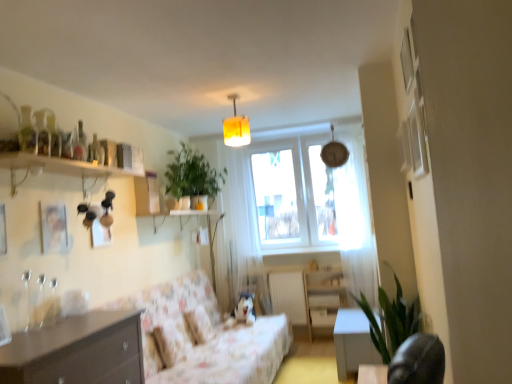
Question: Should I look upward or downward to see floral fabric couch at center?

Choices:
 (A) up
 (B) down

Answer: (B)

Question: Can you confirm if green matte plant at upper center, which is counted as the first plant, starting from the left, is shorter than floral fabric couch at center?

Choices:
 (A) yes
 (B) no

Answer: (A)

Question: Can you confirm if green matte plant at upper center, placed as the 1th plant when sorted from back to front, is thinner than floral fabric couch at center?

Choices:
 (A) yes
 (B) no

Answer: (A)

Question: Is green matte plant at upper center, the 2th plant in the bottom-to-top sequence, to the right of floral fabric couch at center from the viewer's perspective?

Choices:
 (A) no
 (B) yes

Answer: (A)

Question: Is green matte plant at upper center, placed as the 1th plant when sorted from back to front, looking in the opposite direction of floral fabric couch at center?

Choices:
 (A) yes
 (B) no

Answer: (B)

Question: Is green matte plant at upper center, placed as the 2th plant when sorted from front to back, taller than floral fabric couch at center?

Choices:
 (A) yes
 (B) no

Answer: (B)

Question: Does green matte plant at upper center, placed as the 1th plant when sorted from back to front, have a greater width compared to floral fabric couch at center?

Choices:
 (A) no
 (B) yes

Answer: (A)

Question: Is green leafy plant at lower right, which is the second plant from top to bottom, completely or partially outside of fluffy white pillow at center?

Choices:
 (A) yes
 (B) no

Answer: (A)

Question: Considering the relative sizes of green leafy plant at lower right, which is the first plant in front-to-back order, and fluffy white pillow at center in the image provided, is green leafy plant at lower right, which is the first plant in front-to-back order, smaller than fluffy white pillow at center?

Choices:
 (A) yes
 (B) no

Answer: (B)

Question: From a real-world perspective, does green leafy plant at lower right, which appears as the first plant when ordered from the bottom, sit lower than fluffy white pillow at center?

Choices:
 (A) yes
 (B) no

Answer: (B)

Question: Does green leafy plant at lower right, which is the second plant from top to bottom, contain fluffy white pillow at center?

Choices:
 (A) no
 (B) yes

Answer: (A)

Question: Considering the relative sizes of green leafy plant at lower right, which is the first plant in front-to-back order, and fluffy white pillow at center in the image provided, is green leafy plant at lower right, which is the first plant in front-to-back order, shorter than fluffy white pillow at center?

Choices:
 (A) yes
 (B) no

Answer: (B)

Question: Can you confirm if green leafy plant at lower right, which is the second plant from top to bottom, is bigger than fluffy white pillow at center?

Choices:
 (A) yes
 (B) no

Answer: (A)

Question: From a real-world perspective, does white sheer curtain at upper right, marked as the 1th curtain in a right-to-left arrangement, stand above green matte plant at upper center, the 2th plant in the bottom-to-top sequence?

Choices:
 (A) no
 (B) yes

Answer: (A)